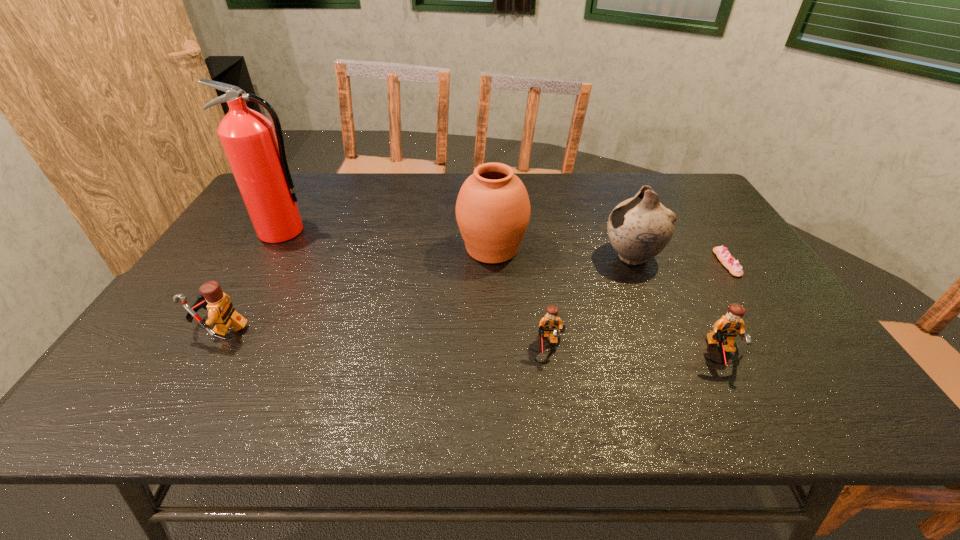
You are a GUI agent. You are given a task and a screenshot of the screen. Output one action in this format:
    pyautogui.click(x=<x>, y=<y>)
    Task: Click on the object situated at the right edge
    The width and height of the screenshot is (960, 540).
    Given the screenshot: What is the action you would take?
    pyautogui.click(x=722, y=253)

Locate an element on the screen. object positioned at the near left corner is located at coordinates (221, 312).

In the image, there is a desktop. At what (x,y) coordinates should I click in order to perform the action: click on vacant space at the far edge. Please return your answer as a coordinate pair (x, y). This screenshot has height=540, width=960. Looking at the image, I should click on (387, 188).

Where is `free region at the near edge`? This screenshot has height=540, width=960. free region at the near edge is located at coordinates (241, 341).

Locate an element on the screen. Image resolution: width=960 pixels, height=540 pixels. vacant space at the left edge of the desktop is located at coordinates (232, 276).

Where is `vacant area at the right edge of the desktop`? Image resolution: width=960 pixels, height=540 pixels. vacant area at the right edge of the desktop is located at coordinates (726, 238).

Identify the location of free spot between the tallest Lego and the tallest object. This screenshot has height=540, width=960. (252, 280).

Locate an element on the screen. This screenshot has height=540, width=960. vacant space that is in between the urn and the rightmost object is located at coordinates (610, 256).

Where is `vacant space that is in between the eclair and the tallest Lego`? Image resolution: width=960 pixels, height=540 pixels. vacant space that is in between the eclair and the tallest Lego is located at coordinates (473, 296).

Where is `vacant space in between the fifth tallest object and the fourth shortest object`? The image size is (960, 540). vacant space in between the fifth tallest object and the fourth shortest object is located at coordinates (469, 342).